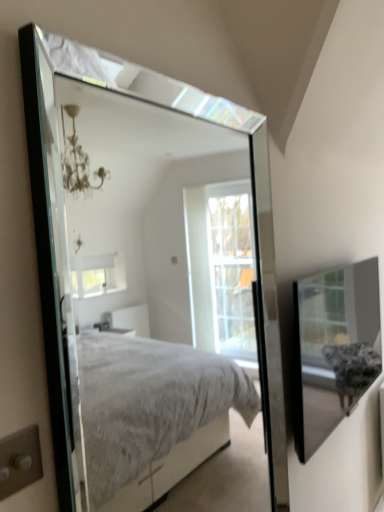
Question: Is clear glass box at upper right at the right side of clear glass mirror at upper center?

Choices:
 (A) yes
 (B) no

Answer: (A)

Question: Does clear glass box at upper right turn towards clear glass mirror at upper center?

Choices:
 (A) yes
 (B) no

Answer: (B)

Question: From a real-world perspective, does clear glass box at upper right stand above clear glass mirror at upper center?

Choices:
 (A) no
 (B) yes

Answer: (A)

Question: From the image's perspective, is clear glass box at upper right above clear glass mirror at upper center?

Choices:
 (A) no
 (B) yes

Answer: (A)

Question: Considering the relative positions of clear glass box at upper right and clear glass mirror at upper center in the image provided, is clear glass box at upper right to the left of clear glass mirror at upper center from the viewer's perspective?

Choices:
 (A) no
 (B) yes

Answer: (A)

Question: Could clear glass mirror at upper center be considered to be inside clear glass box at upper right?

Choices:
 (A) no
 (B) yes

Answer: (A)

Question: Is clear glass mirror at upper center not near clear glass box at upper right?

Choices:
 (A) yes
 (B) no

Answer: (A)

Question: Does clear glass mirror at upper center have a lesser width compared to clear glass box at upper right?

Choices:
 (A) no
 (B) yes

Answer: (B)

Question: From a real-world perspective, does clear glass mirror at upper center stand above clear glass box at upper right?

Choices:
 (A) yes
 (B) no

Answer: (A)

Question: Does clear glass mirror at upper center have a greater width compared to clear glass box at upper right?

Choices:
 (A) yes
 (B) no

Answer: (B)

Question: From the image's perspective, is clear glass mirror at upper center on clear glass box at upper right?

Choices:
 (A) yes
 (B) no

Answer: (A)

Question: Is clear glass mirror at upper center behind clear glass box at upper right?

Choices:
 (A) no
 (B) yes

Answer: (A)

Question: Is clear glass box at upper right spatially inside clear glass mirror at upper center, or outside of it?

Choices:
 (A) outside
 (B) inside

Answer: (A)